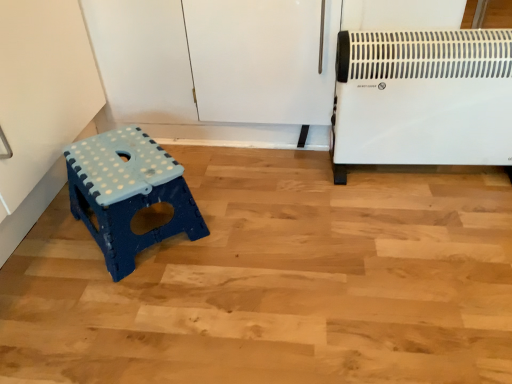
Locate an element on the screen. This screenshot has height=384, width=512. vacant point to the left of blue plastic stool at lower left is located at coordinates (44, 249).